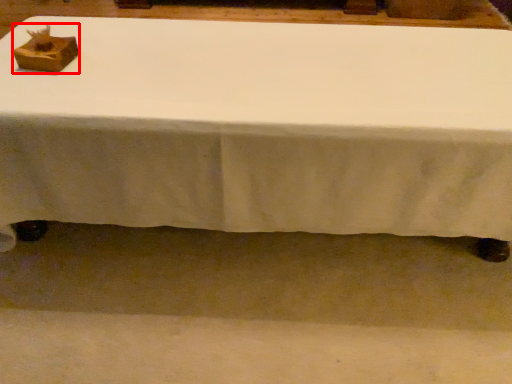
Question: From the image, what is the correct spatial relationship of shoe box (annotated by the red box) in relation to table?

Choices:
 (A) right
 (B) left

Answer: (B)